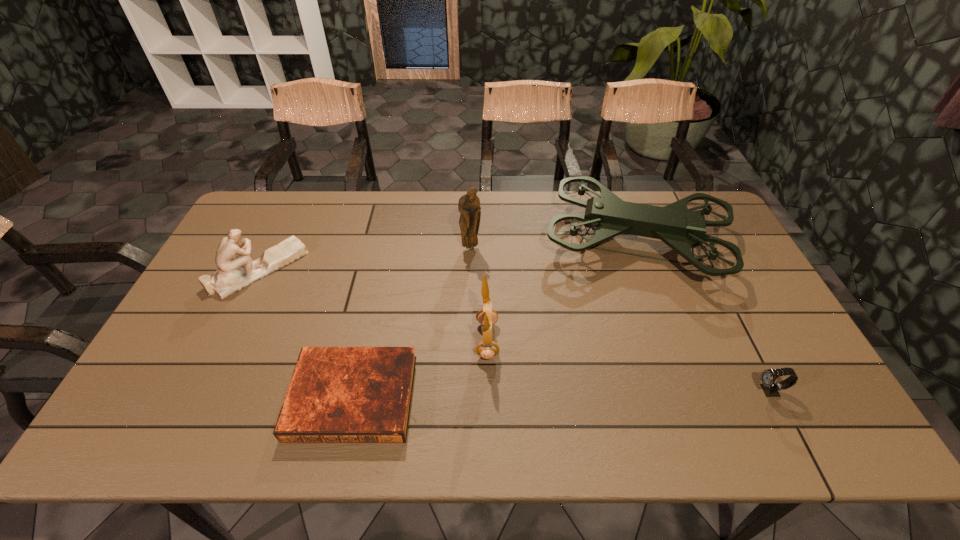
Locate an element on the screen. free location that satisfies the following two spatial constraints: 1. on the face of the second shortest object; 2. on the spine side of the Bible is located at coordinates (773, 397).